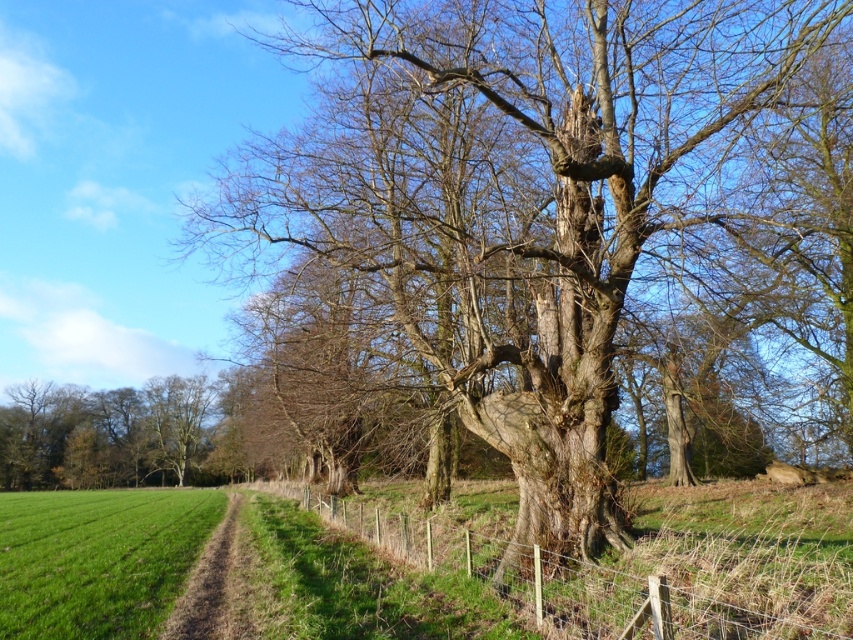
You are a hiker trying to decide whether to walk around the smooth bark tree at center or take the brown dirt path at lower left. Based on their sizes, which option would give you more space to move comfortably?

The smooth bark tree at center has a larger size compared to the brown dirt path at lower left, so taking the brown dirt path at lower left would provide more space to move comfortably.

You are a hiker trying to find a shortcut through the field. You see the smooth bark tree at center and the brown dirt path at lower left. Which direction should you head towards to reach the path from the tree?

The smooth bark tree at center is positioned on the right side of the brown dirt path at lower left, so to reach the path from the tree, you should head towards the left direction.

You are a hiker who wants to take a photo of the smooth bark tree at center and the brown dirt path at lower left. Which object should you focus on first if you want to capture both in a single frame without adjusting your camera focus?

You should focus on the smooth bark tree at center first because it is closer to the viewer than the brown dirt path at lower left, so focusing on the closer object will ensure both are in focus when using depth of field properly.